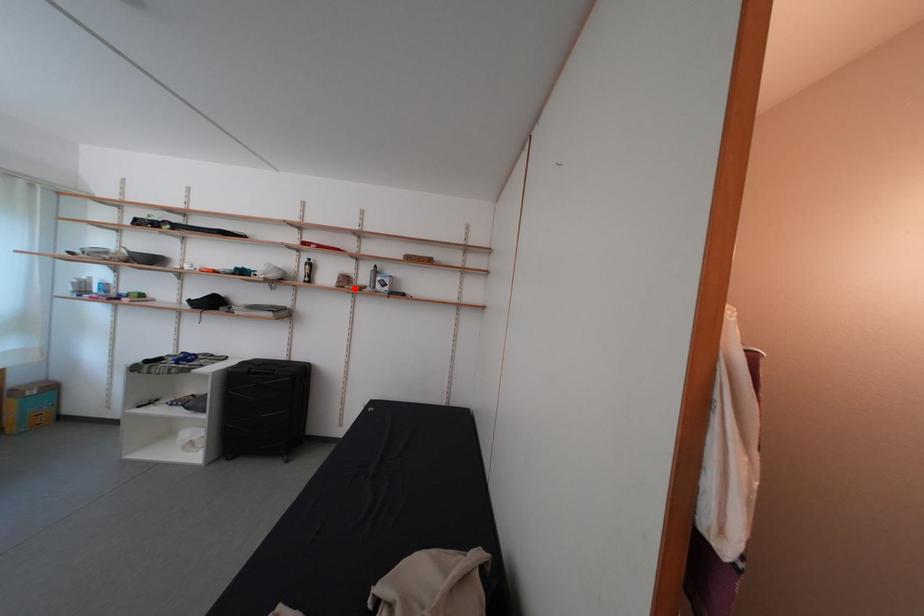
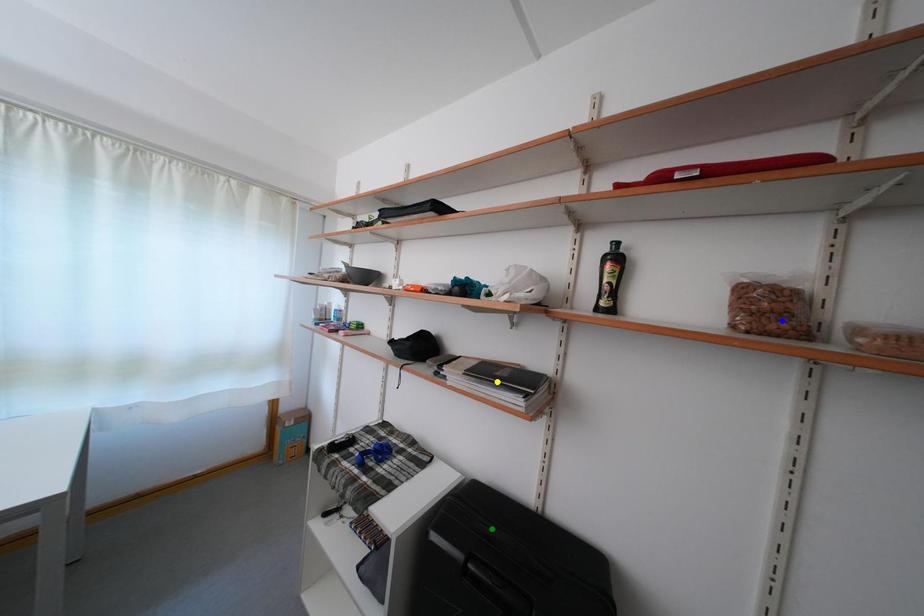
Question: I am providing you with two images of the same scene from different viewpoints. A red point is marked on the first image. You are given multiple points on the second image. Which mark in image 2 goes with the point in image 1?

Choices:
 (A) green point
 (B) yellow point
 (C) blue point

Answer: (C)